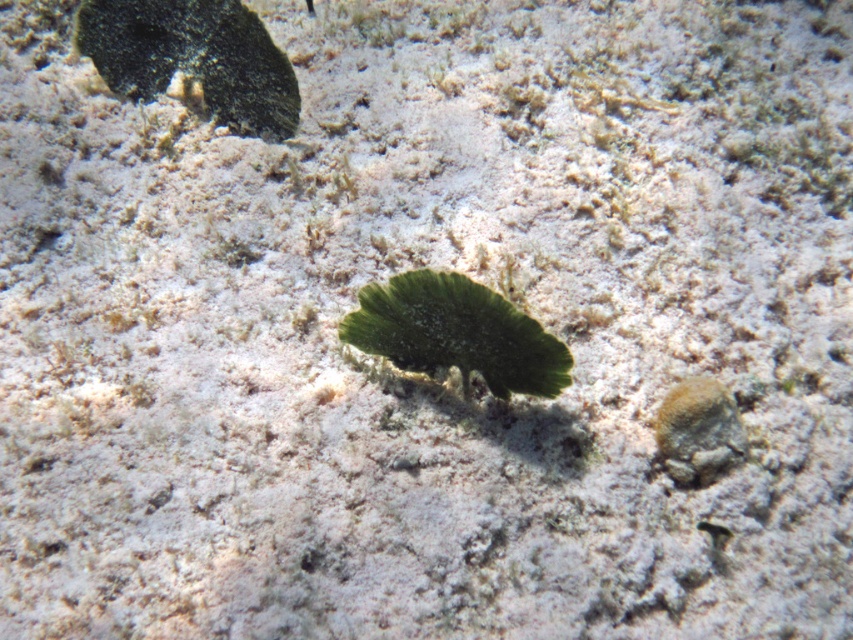
You are a marine biologist studying underwater objects. You observe the smooth dark green leaf at upper left and the rusty metallic rock at lower right. Which object is wider?

The smooth dark green leaf at upper left is wider than the rusty metallic rock at lower right.

You are a diver swimming underwater and want to reach both points marked as point (125, 76) and point (397, 317). Which point should you aim for first if you want to reach the one closer to you?

You should aim for point (125, 76) first because it is closer to you than point (397, 317).